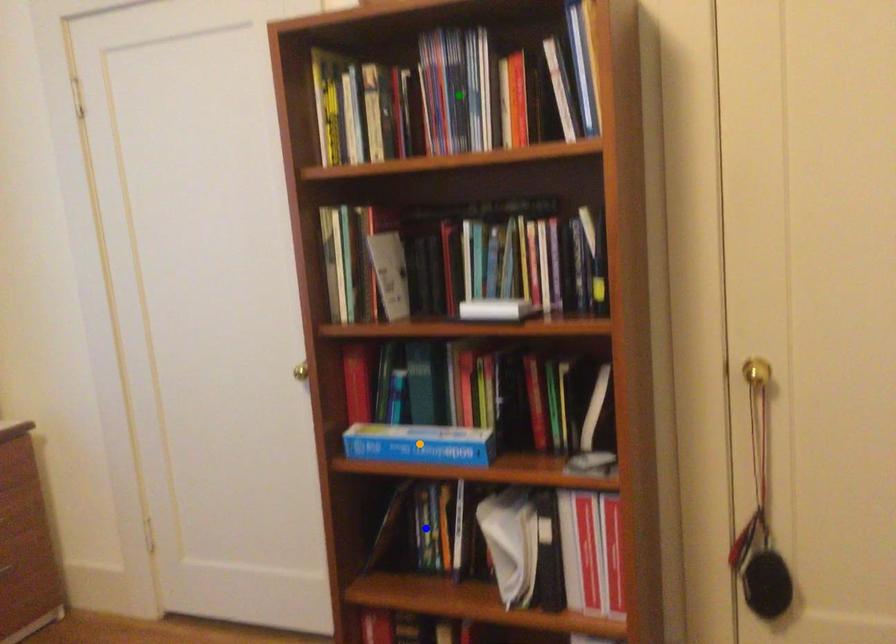
Based on the photo, order these from nearest to farthest:
green point, blue point, orange point

green point, orange point, blue point